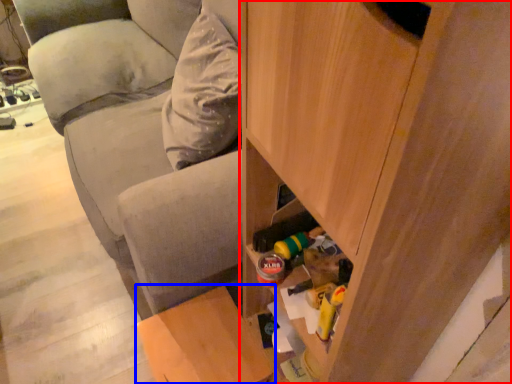
Question: Which object is further to the camera taking this photo, cabinetry (highlighted by a red box) or furniture (highlighted by a blue box)?

Choices:
 (A) cabinetry
 (B) furniture

Answer: (B)